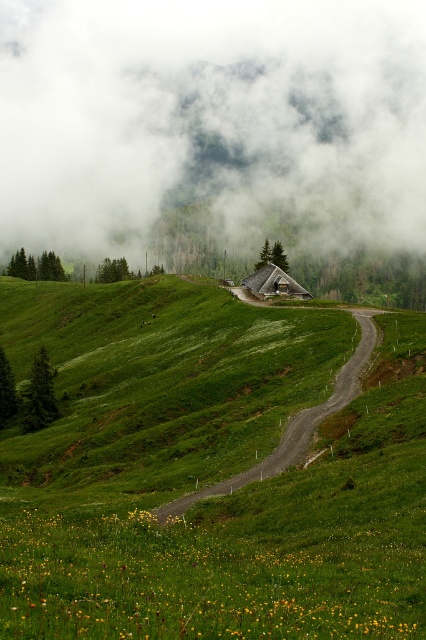
Question: Which object appears farthest from the camera in this image?

Choices:
 (A) green grassy hillside at center
 (B) white fluffy cloud at upper center
 (C) wooden cabin at center
 (D) gravel road at center

Answer: (B)

Question: Is white fluffy cloud at upper center further to camera compared to gravel road at center?

Choices:
 (A) no
 (B) yes

Answer: (B)

Question: In this image, where is gravel road at center located relative to wooden cabin at center?

Choices:
 (A) right
 (B) left

Answer: (A)

Question: Which is nearer to the gravel road at center?

Choices:
 (A) green grassy hillside at center
 (B) wooden cabin at center
 (C) white fluffy cloud at upper center

Answer: (A)

Question: In this image, where is green grassy hillside at center located relative to white fluffy cloud at upper center?

Choices:
 (A) left
 (B) right

Answer: (B)

Question: Based on their relative distances, which object is farther from the green grassy hillside at center?

Choices:
 (A) white fluffy cloud at upper center
 (B) wooden cabin at center

Answer: (A)